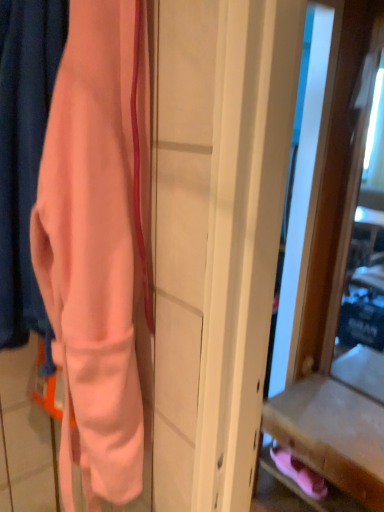
The width and height of the screenshot is (384, 512). Identify the location of pink suede shoes at lower right. (299, 473).

What do you see at coordinates (332, 434) in the screenshot? The width and height of the screenshot is (384, 512). I see `wooden drawer at lower right` at bounding box center [332, 434].

Describe the element at coordinates (24, 152) in the screenshot. Image resolution: width=384 pixels, height=512 pixels. I see `matte peach fabric at left` at that location.

This screenshot has height=512, width=384. Find the location of `pink suede shoes at lower right`. pink suede shoes at lower right is located at coordinates (299, 473).

Between pink suede shoes at lower right and wooden drawer at lower right, which one has less height?

Standing shorter between the two is pink suede shoes at lower right.

From the image's perspective, between pink suede shoes at lower right and wooden drawer at lower right, who is located below?

wooden drawer at lower right.

From a real-world perspective, is pink suede shoes at lower right physically located above or below wooden drawer at lower right?

Clearly, from a real-world perspective, pink suede shoes at lower right is above wooden drawer at lower right.

Which object is wider, matte peach fabric at left or wooden drawer at lower right?

Wider between the two is wooden drawer at lower right.

From the image's perspective, who appears lower, matte peach fabric at left or wooden drawer at lower right?

wooden drawer at lower right appears lower in the image.

Is matte peach fabric at left positioned beyond the bounds of wooden drawer at lower right?

Yes.

How far apart are matte peach fabric at left and wooden drawer at lower right?

matte peach fabric at left is 4.35 feet away from wooden drawer at lower right.

Can you confirm if pink suede shoes at lower right is wider than matte peach fabric at left?

In fact, pink suede shoes at lower right might be narrower than matte peach fabric at left.

Is pink suede shoes at lower right not close to matte peach fabric at left?

Absolutely, pink suede shoes at lower right is distant from matte peach fabric at left.

Which point is more distant from viewer, (296, 477) or (25, 240)?

The point (296, 477) is farther.

From a real-world perspective, is wooden drawer at lower right beneath matte peach fabric at left?

Yes, from a real-world perspective, wooden drawer at lower right is under matte peach fabric at left.

Between wooden drawer at lower right and matte peach fabric at left, which one has less height?

wooden drawer at lower right is shorter.

How different are the orientations of wooden drawer at lower right and matte peach fabric at left in degrees?

The facing directions of wooden drawer at lower right and matte peach fabric at left are 0.668 degrees apart.

Is wooden drawer at lower right far from pink suede shoes at lower right?

No.

From a real-world perspective, which is physically below, wooden drawer at lower right or pink suede shoes at lower right?

wooden drawer at lower right.

Is wooden drawer at lower right positioned with its back to pink suede shoes at lower right?

Absolutely, wooden drawer at lower right is directed away from pink suede shoes at lower right.

Considering their positions, is matte peach fabric at left located in front of or behind pink suede shoes at lower right?

matte peach fabric at left is positioned closer to the viewer than pink suede shoes at lower right.

Is matte peach fabric at left aimed at pink suede shoes at lower right?

No.

Based on their sizes in the image, would you say matte peach fabric at left is bigger or smaller than pink suede shoes at lower right?

Considering their sizes, matte peach fabric at left takes up more space than pink suede shoes at lower right.

In order to click on footwear lying above the wooden drawer at lower right (from the image's perspective) in this screenshot , I will do `click(299, 473)`.

Locate an element on the screen. The height and width of the screenshot is (512, 384). drawer below the matte peach fabric at left (from the image's perspective) is located at coordinates (332, 434).

Based on their spatial positions, is pink suede shoes at lower right or matte peach fabric at left closer to wooden drawer at lower right?

pink suede shoes at lower right is closer to wooden drawer at lower right.

When comparing their distances from pink suede shoes at lower right, does wooden drawer at lower right or matte peach fabric at left seem closer?

Among the two, wooden drawer at lower right is located nearer to pink suede shoes at lower right.

From the picture: Estimate the real-world distances between objects in this image. Which object is closer to wooden drawer at lower right, matte peach fabric at left or pink suede shoes at lower right?

The object closer to wooden drawer at lower right is pink suede shoes at lower right.

Considering their positions, is wooden drawer at lower right positioned closer to matte peach fabric at left than pink suede shoes at lower right?

Based on the image, wooden drawer at lower right appears to be nearer to matte peach fabric at left.

When comparing their distances from pink suede shoes at lower right, does matte peach fabric at left or wooden drawer at lower right seem closer?

wooden drawer at lower right is closer to pink suede shoes at lower right.

When comparing their distances from matte peach fabric at left, does pink suede shoes at lower right or wooden drawer at lower right seem further?

pink suede shoes at lower right is further to matte peach fabric at left.

This screenshot has height=512, width=384. Find the location of `drawer between matte peach fabric at left and pink suede shoes at lower right in the front-back direction`. drawer between matte peach fabric at left and pink suede shoes at lower right in the front-back direction is located at coordinates (332, 434).